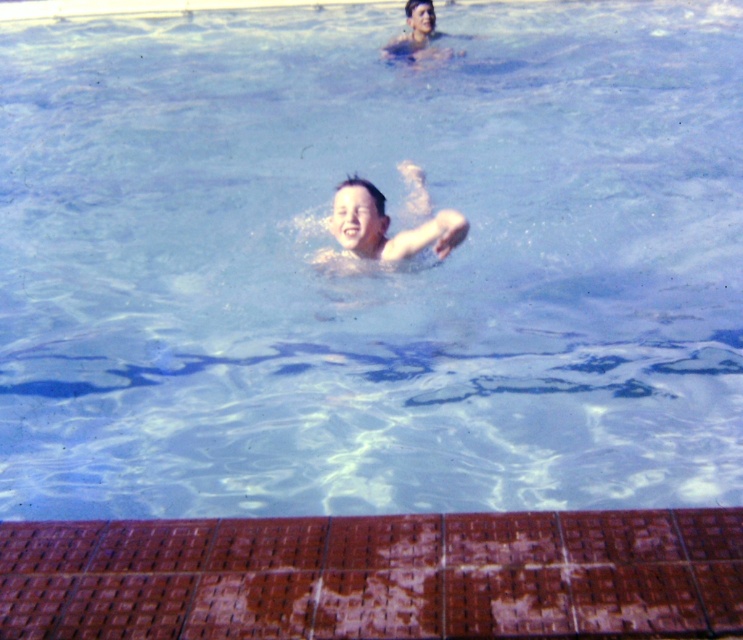
Question: Is smooth skin boy at center to the right of smooth skin man at upper center from the viewer's perspective?

Choices:
 (A) no
 (B) yes

Answer: (A)

Question: Can you confirm if smooth skin boy at center is positioned below smooth skin man at upper center?

Choices:
 (A) yes
 (B) no

Answer: (A)

Question: Which point appears closest to the camera in this image?

Choices:
 (A) (415, 10)
 (B) (374, 236)

Answer: (B)

Question: Can you confirm if smooth skin boy at center is positioned below smooth skin man at upper center?

Choices:
 (A) yes
 (B) no

Answer: (A)